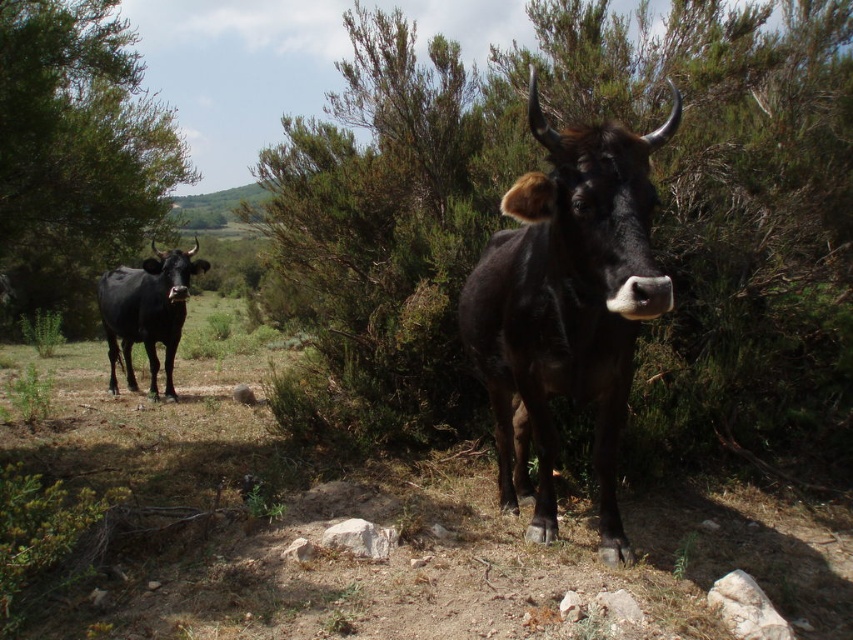
Does point (762, 296) come farther from viewer compared to point (97, 164)?

Yes, it is behind point (97, 164).

Who is more distant from viewer, (352,140) or (94,157)?

Positioned behind is point (352,140).

This screenshot has height=640, width=853. Describe the element at coordinates (654, 220) in the screenshot. I see `green leafy bush at center` at that location.

At what (x,y) coordinates should I click in order to perform the action: click on green leafy bush at center. Please return your answer as a coordinate pair (x, y). Image resolution: width=853 pixels, height=640 pixels. Looking at the image, I should click on 654,220.

Who is taller, green leafy tree at left or shiny black bull at left?

Standing taller between the two is green leafy tree at left.

Does green leafy tree at left have a greater width compared to shiny black bull at left?

Yes.

Is point (120, 152) farther from camera compared to point (109, 371)?

No, it is in front of (109, 371).

Where is `green leafy tree at left`? This screenshot has height=640, width=853. green leafy tree at left is located at coordinates coord(74,154).

Can you confirm if black glossy bull at center is smaller than green leafy tree at left?

Correct, black glossy bull at center occupies less space than green leafy tree at left.

Between point (614, 388) and point (38, 234), which one is positioned behind?

The point (38, 234) is behind.

Where is `black glossy bull at center`? This screenshot has width=853, height=640. black glossy bull at center is located at coordinates (566, 305).

Find the location of `black glossy bull at center`. black glossy bull at center is located at coordinates pyautogui.click(x=566, y=305).